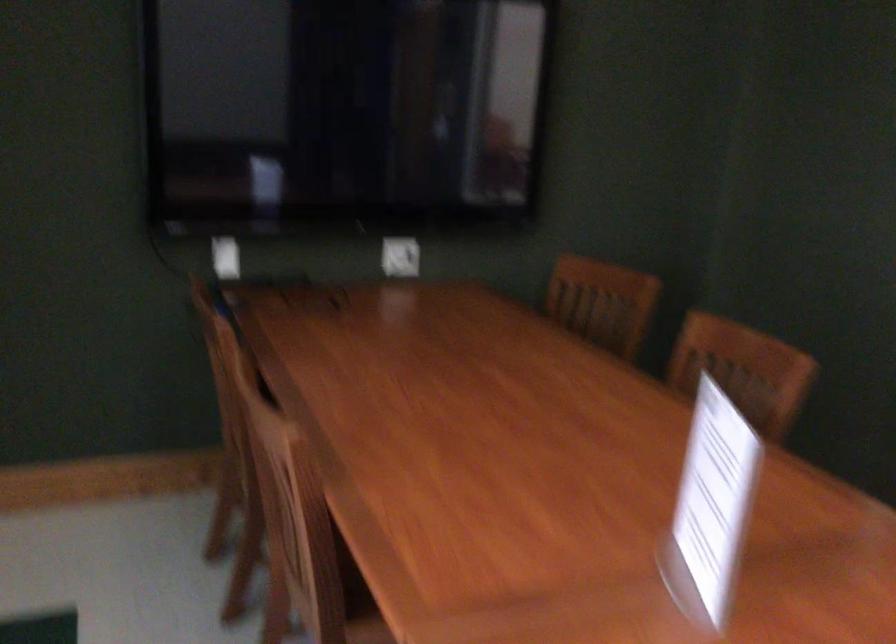
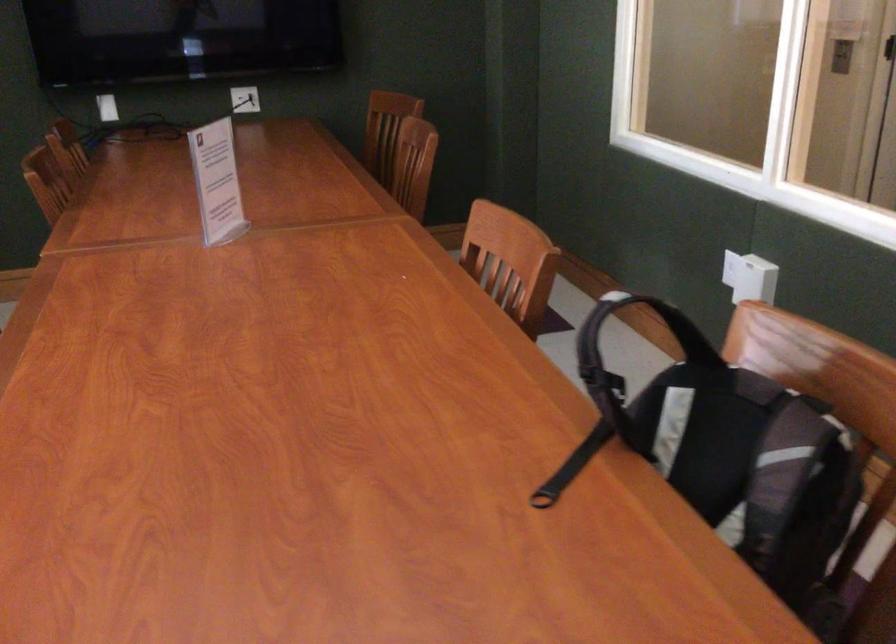
The images are taken continuously from a first-person perspective. In which direction are you moving?

The cameraman moved toward right, backward.